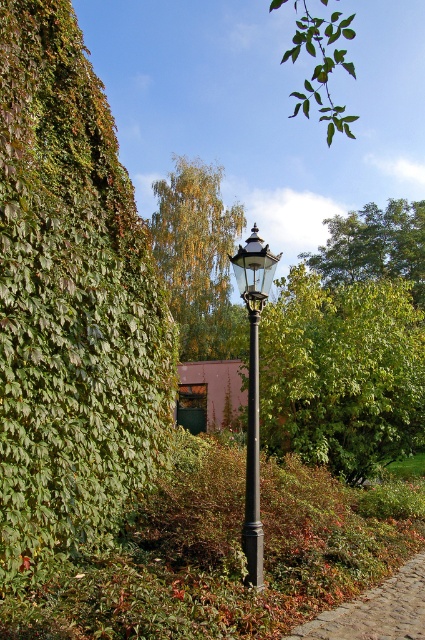
Question: Can you confirm if black metal street light at center is smaller than black polished pole at center?

Choices:
 (A) yes
 (B) no

Answer: (A)

Question: Which object appears closest to the camera in this image?

Choices:
 (A) yellow-green leaves at upper center
 (B) green leafy tree at center
 (C) black polished pole at center

Answer: (C)

Question: Is green leafy tree at center above yellow-green leaves at upper center?

Choices:
 (A) no
 (B) yes

Answer: (A)

Question: Can you confirm if green leafy tree at center is smaller than black metal street light at center?

Choices:
 (A) no
 (B) yes

Answer: (A)

Question: Which object appears farthest from the camera in this image?

Choices:
 (A) green leafy tree at center
 (B) black metal street light at center

Answer: (A)

Question: Which of the following is the closest to the observer?

Choices:
 (A) green leafy tree at upper center
 (B) green leafy tree at center

Answer: (B)